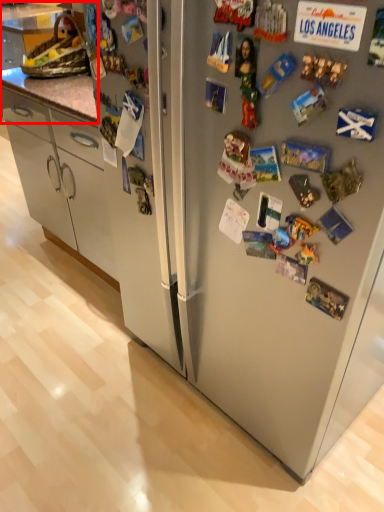
Question: Considering the relative positions of counter top (annotated by the red box) and refrigerator in the image provided, where is counter top (annotated by the red box) located with respect to the staircase?

Choices:
 (A) right
 (B) left

Answer: (A)